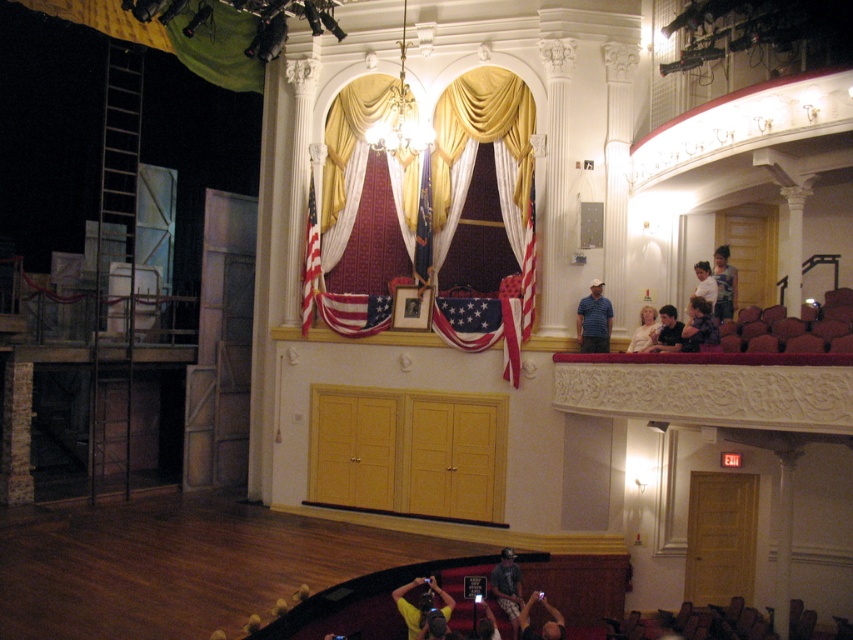
You are standing in the theater and see the point at coordinates (595, 321). Which object is this point located on?

The point at coordinates (595, 321) is located on the blue shirt at upper center.